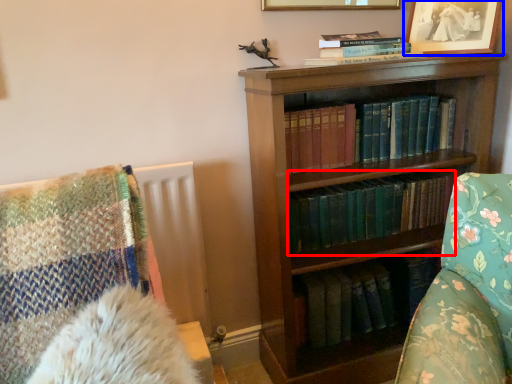
Question: Which object is closer to the camera taking this photo, book (highlighted by a red box) or picture frame (highlighted by a blue box)?

Choices:
 (A) book
 (B) picture frame

Answer: (B)